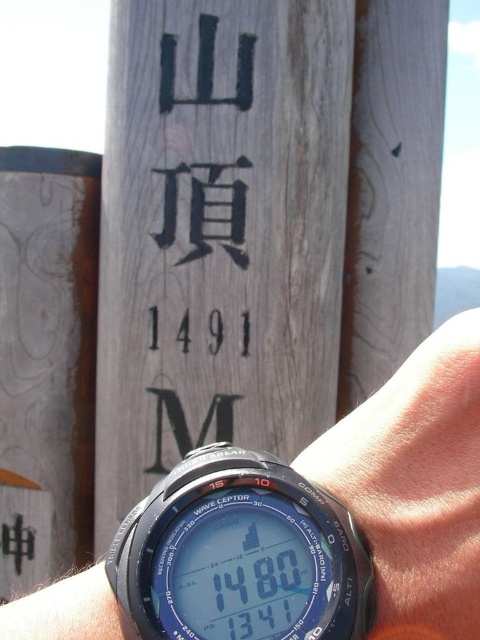
Is point (338, 502) farther from camera compared to point (431, 436)?

No, (338, 502) is in front of (431, 436).

Does black plastic digital watch at center come in front of black rubber watch at center?

Yes.

You are a GUI agent. You are given a task and a screenshot of the screen. Output one action in this format:
    pyautogui.click(x=<x>, y=<y>)
    Task: Click on the black plastic digital watch at center
    The width and height of the screenshot is (480, 640).
    Given the screenshot: What is the action you would take?
    pyautogui.click(x=240, y=554)